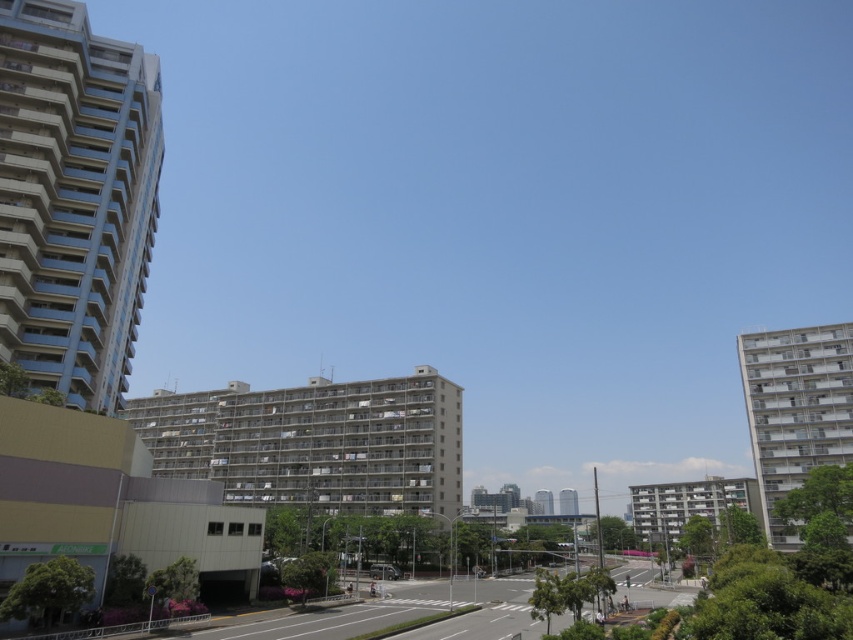
You are a city planner assessing the urban layout. You need to determine which of the two structures, the white glossy building at right or the smooth concrete tower at center, has a greater horizontal space requirement for construction. Based on the scene, which one requires more horizontal space?

The smooth concrete tower at center requires more horizontal space because its width is greater than the white glossy building at right.